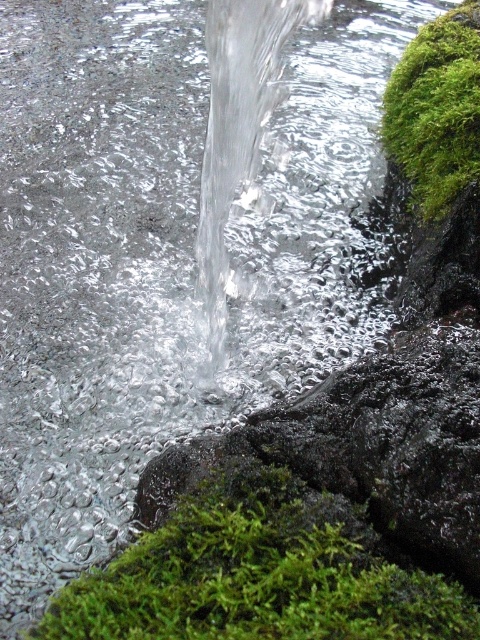
Locate an element on the screen. This screenshot has width=480, height=640. green fuzzy moss at lower center is located at coordinates (260, 576).

Which is more to the right, green fuzzy moss at lower center or green fuzzy moss at upper right?

green fuzzy moss at upper right

This screenshot has width=480, height=640. I want to click on green fuzzy moss at lower center, so click(x=260, y=576).